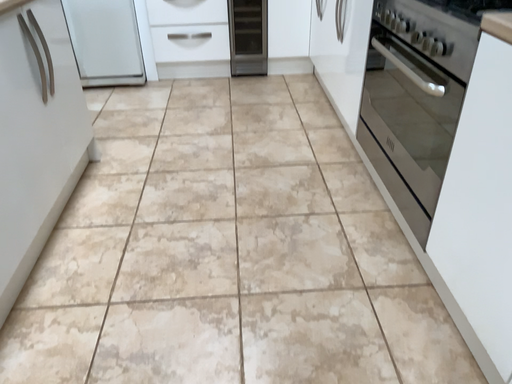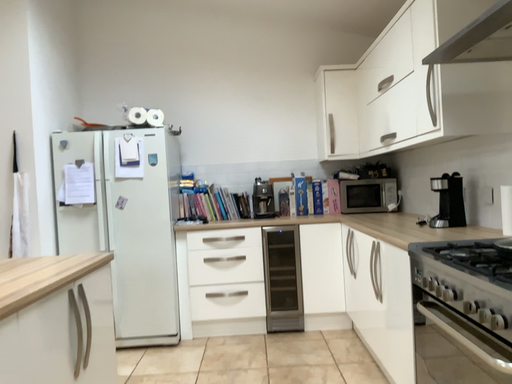
Question: How did the camera likely rotate when shooting the video?

Choices:
 (A) rotated downward
 (B) rotated upward

Answer: (B)